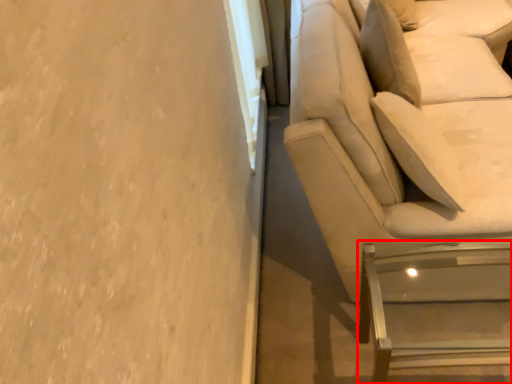
Question: Where is furniture (annotated by the red box) located in relation to studio couch in the image?

Choices:
 (A) right
 (B) left

Answer: (B)